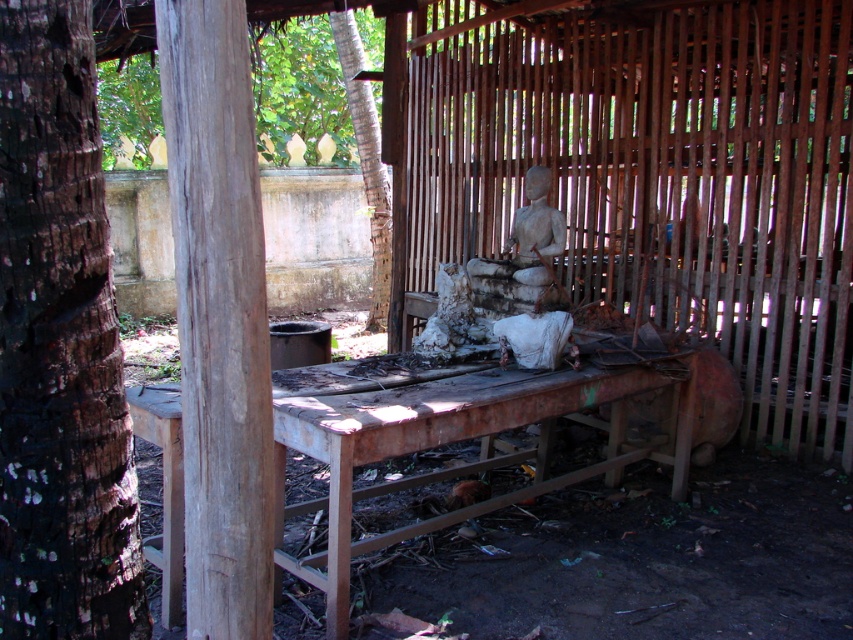
Is rusty metal picnic table at center further to the viewer compared to brown bark tree at upper left?

No, it is in front of brown bark tree at upper left.

Does point (369, 432) lie behind point (334, 36)?

No, (369, 432) is closer to viewer.

Identify the location of rusty metal picnic table at center. Image resolution: width=853 pixels, height=640 pixels. (445, 442).

Is brown rough bark tree at left wider than rusty metal picnic table at center?

Incorrect, brown rough bark tree at left's width does not surpass rusty metal picnic table at center's.

Who is more distant from viewer, (x=28, y=61) or (x=280, y=547)?

Point (x=280, y=547)

The image size is (853, 640). What are the coordinates of `brown rough bark tree at left` in the screenshot? It's located at (59, 346).

At what (x,y) coordinates should I click in order to perform the action: click on brown rough bark tree at left. Please return your answer as a coordinate pair (x, y). Image resolution: width=853 pixels, height=640 pixels. Looking at the image, I should click on (59, 346).

Can you confirm if brown rough bark tree at left is positioned to the right of weathered wood post at center?

In fact, brown rough bark tree at left is to the left of weathered wood post at center.

Is brown rough bark tree at left thinner than weathered wood post at center?

Yes.

Where is `brown rough bark tree at left`? The width and height of the screenshot is (853, 640). brown rough bark tree at left is located at coordinates (59, 346).